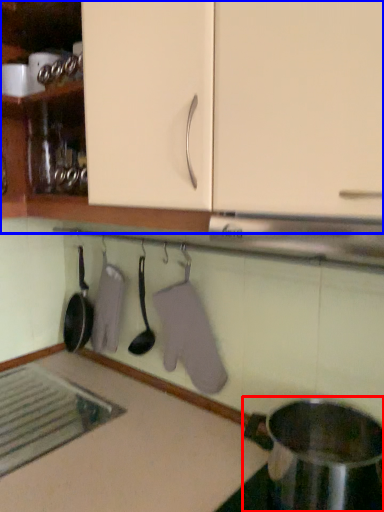
Question: Among these objects, which one is nearest to the camera, appliance (highlighted by a red box) or cabinetry (highlighted by a blue box)?

Choices:
 (A) appliance
 (B) cabinetry

Answer: (B)